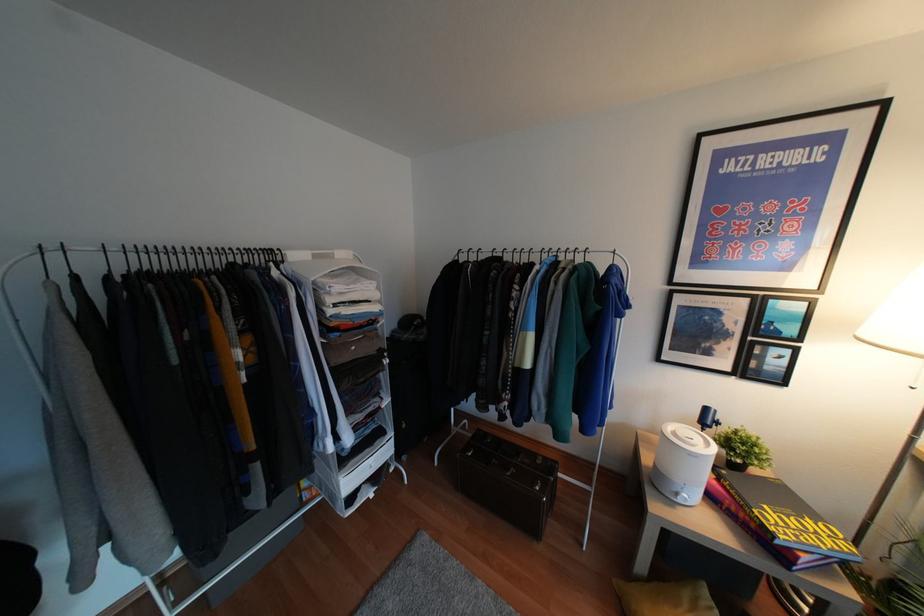
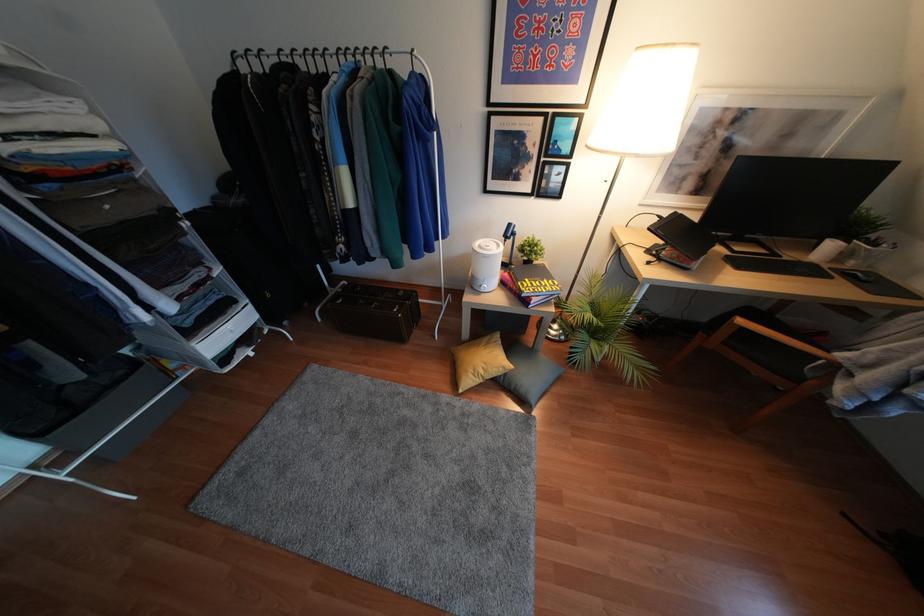
Find the pixel in the second image that matches point (678, 500) in the first image.

(481, 290)